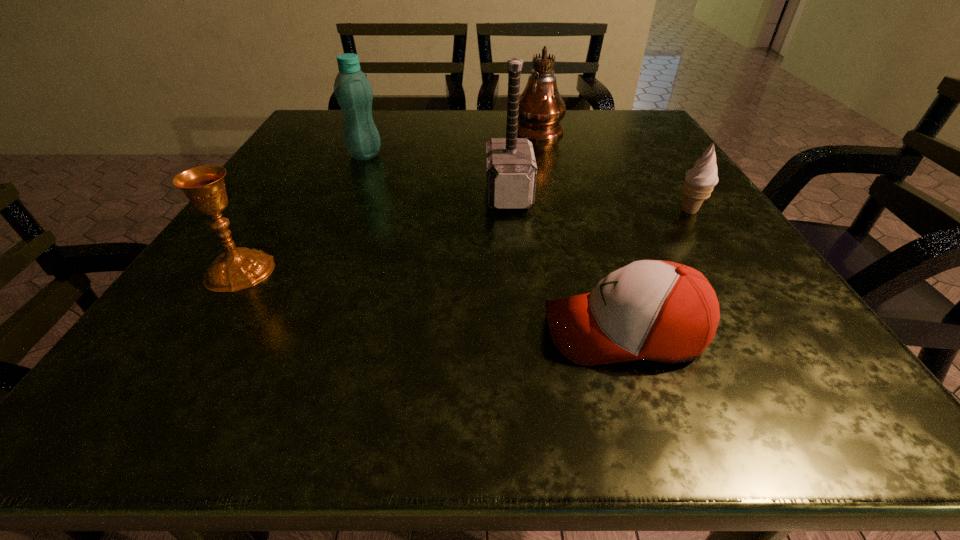
Where is `free space located on the front-facing side of the nearest object`? Image resolution: width=960 pixels, height=540 pixels. free space located on the front-facing side of the nearest object is located at coordinates (382, 332).

You are a GUI agent. You are given a task and a screenshot of the screen. Output one action in this format:
    pyautogui.click(x=<x>, y=<y>)
    Task: Click on the vacant region located 0.230m on the front-facing side of the nearest object
    
    Given the screenshot: What is the action you would take?
    pyautogui.click(x=367, y=332)

Identify the location of blank space located on the front-facing side of the nearest object. (420, 332).

I want to click on oil lamp that is at the far edge, so click(x=541, y=108).

You are a GUI agent. You are given a task and a screenshot of the screen. Output one action in this format:
    pyautogui.click(x=<x>, y=<y>)
    Task: Click on the water bottle that is at the far edge
    The width and height of the screenshot is (960, 540).
    Given the screenshot: What is the action you would take?
    pyautogui.click(x=353, y=91)

Identify the location of object that is at the near edge. This screenshot has width=960, height=540. (663, 311).

Where is `water bottle at the left edge`? This screenshot has height=540, width=960. water bottle at the left edge is located at coordinates (353, 91).

Locate an element on the screen. The height and width of the screenshot is (540, 960). chalice that is positioned at the left edge is located at coordinates (237, 268).

Where is `icecream that is at the right edge`? icecream that is at the right edge is located at coordinates (700, 180).

You are a GUI agent. You are given a task and a screenshot of the screen. Output one action in this format:
    pyautogui.click(x=<x>, y=<y>)
    Task: Click on the baseball cap that is at the right edge
    This screenshot has width=960, height=540.
    Given the screenshot: What is the action you would take?
    pyautogui.click(x=663, y=311)